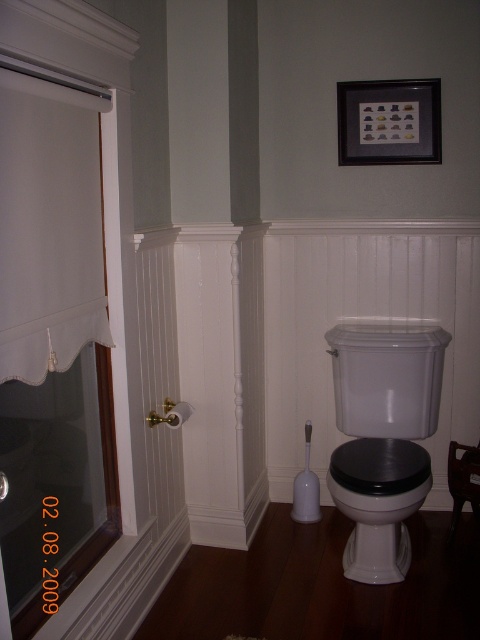
You are standing in the bathroom and want to reach the point at coordinates point (36, 80). If you take a step forward, will you be closer to the point than 5 feet?

The point (36, 80) is 4.89 feet away from camera, so yes, taking a step forward will bring you closer than 5 feet.

You are standing in the bathroom and want to reach the point marked as point [67,113]. If your arm can extend 5 feet, can you reach that point without moving your feet?

The point [67,113] is 5.46 feet away from you, which is slightly beyond your arm reach of 5 feet. Therefore, you cannot reach it without moving your feet.